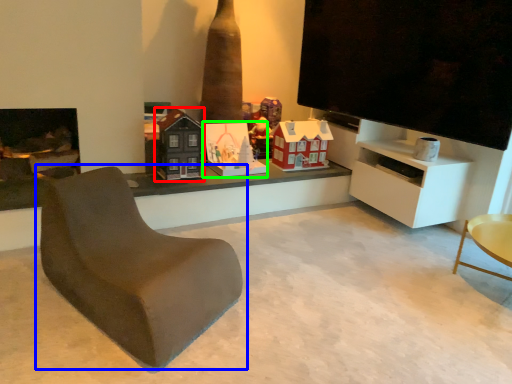
Question: Which object is positioned farthest from toy (highlighted by a red box)? Select from chair (highlighted by a blue box) and toy (highlighted by a green box).

Choices:
 (A) chair
 (B) toy

Answer: (A)